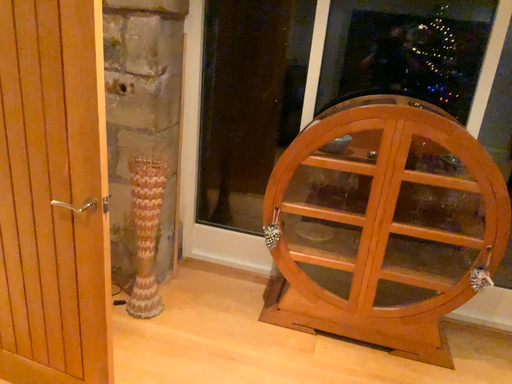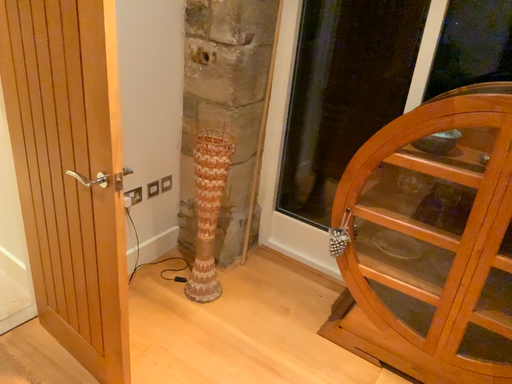
Question: Which way did the camera rotate in the video?

Choices:
 (A) rotated left
 (B) rotated right

Answer: (A)